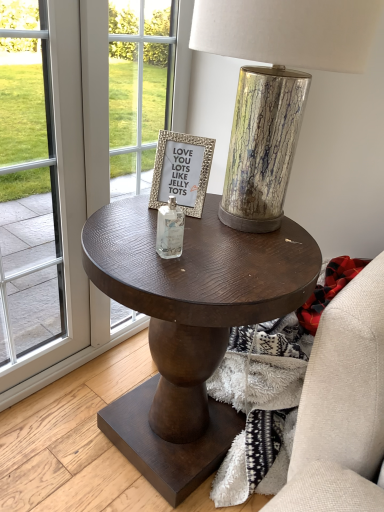
Locate an element on the screen. vacant area located to the right-hand side of clear glass bottle at center is located at coordinates (238, 258).